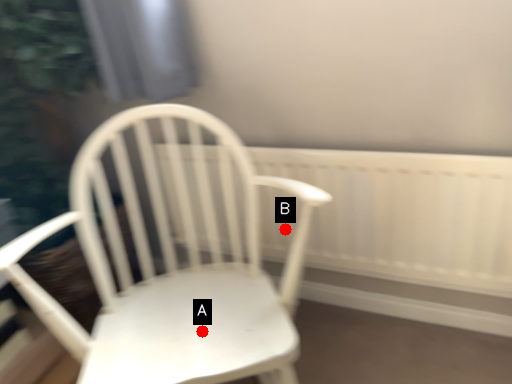
Question: Two points are circled on the image, labeled by A and B beside each circle. Which of the following is the farthest from the observer?

Choices:
 (A) A is further
 (B) B is further

Answer: (B)